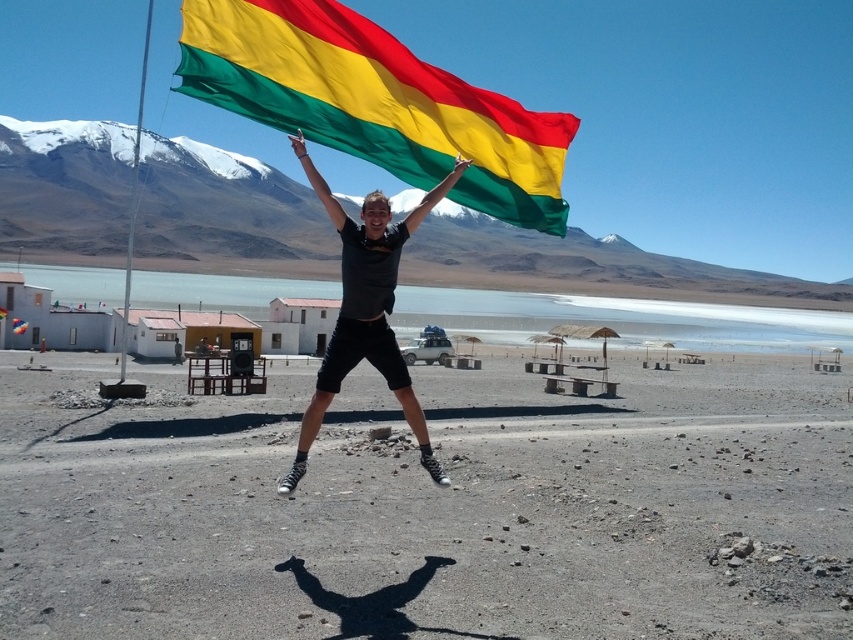
Does yellow-green-red fabric flag at upper center have a greater height compared to yellow-green fabric flag at upper center?

Indeed, yellow-green-red fabric flag at upper center has a greater height compared to yellow-green fabric flag at upper center.

Who is positioned more to the right, yellow-green-red fabric flag at upper center or yellow-green fabric flag at upper center?

yellow-green-red fabric flag at upper center

Which is in front, point (502, 186) or point (13, 330)?

Positioned in front is point (502, 186).

Where is `yellow-green-red fabric flag at upper center`? This screenshot has height=640, width=853. yellow-green-red fabric flag at upper center is located at coordinates (374, 102).

Which is above, matte black shorts at center or yellow-green fabric flag at upper center?

matte black shorts at center is higher up.

Who is shorter, matte black shorts at center or yellow-green fabric flag at upper center?

Standing shorter between the two is yellow-green fabric flag at upper center.

Identify the location of matte black shorts at center. Image resolution: width=853 pixels, height=640 pixels. (366, 308).

Between yellow-green-red fabric flag at upper center and matte black shorts at center, which one has less height?

Standing shorter between the two is yellow-green-red fabric flag at upper center.

Looking at this image, does yellow-green-red fabric flag at upper center have a lesser width compared to matte black shorts at center?

Incorrect, yellow-green-red fabric flag at upper center's width is not less than matte black shorts at center's.

Between point (445, 81) and point (393, 340), which one is positioned behind?

Point (445, 81)

Locate an element on the screen. This screenshot has height=640, width=853. yellow-green-red fabric flag at upper center is located at coordinates (374, 102).